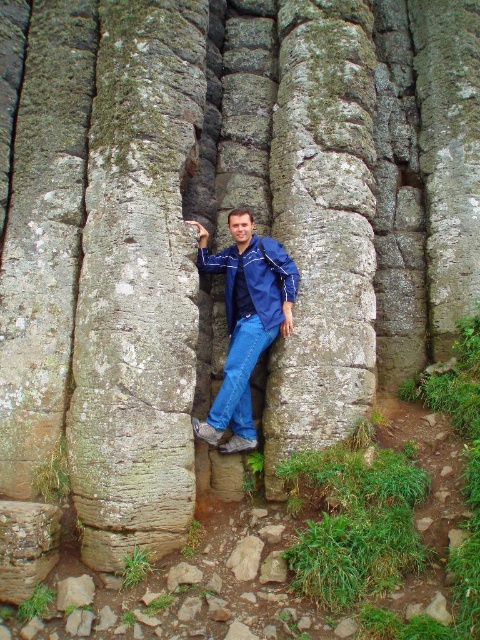
Question: Does blue denim jeans at center have a larger size compared to blue denim jacket at center?

Choices:
 (A) yes
 (B) no

Answer: (A)

Question: Can you confirm if blue denim jeans at center is positioned to the right of blue denim jacket at center?

Choices:
 (A) no
 (B) yes

Answer: (A)

Question: Is blue denim jeans at center smaller than blue denim jacket at center?

Choices:
 (A) yes
 (B) no

Answer: (B)

Question: Among these points, which one is farthest from the camera?

Choices:
 (A) (235, 234)
 (B) (231, 314)

Answer: (B)

Question: Among these points, which one is farthest from the camera?

Choices:
 (A) (231, 324)
 (B) (236, 432)

Answer: (A)